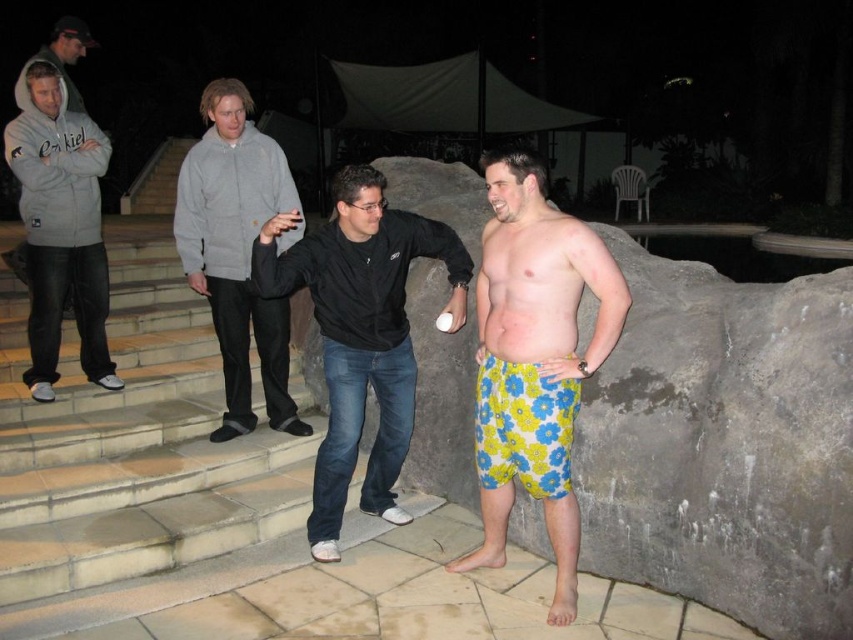
In the scene shown: Does matte gray hoodie at left appear on the right side of floral cotton shorts at center?

In fact, matte gray hoodie at left is to the left of floral cotton shorts at center.

Find the location of a particular element. Image resolution: width=853 pixels, height=640 pixels. matte gray hoodie at left is located at coordinates (61, 227).

Consider the image. Between floral-patterned shorts at center and black matte jacket at center, which one has more height?

Standing taller between the two is floral-patterned shorts at center.

This screenshot has width=853, height=640. What do you see at coordinates (534, 360) in the screenshot? I see `floral-patterned shorts at center` at bounding box center [534, 360].

Measure the distance between floral-patterned shorts at center and camera.

They are 2.83 meters apart.

Locate an element on the screen. This screenshot has height=640, width=853. floral-patterned shorts at center is located at coordinates (534, 360).

Is gray fleece hoodie at left further to the viewer compared to floral cotton shorts at center?

That is True.

Which of these two, gray fleece hoodie at left or floral cotton shorts at center, stands taller?

With more height is gray fleece hoodie at left.

Is point (233, 243) more distant than point (550, 456)?

Yes.

Image resolution: width=853 pixels, height=640 pixels. Identify the location of gray fleece hoodie at left. (236, 252).